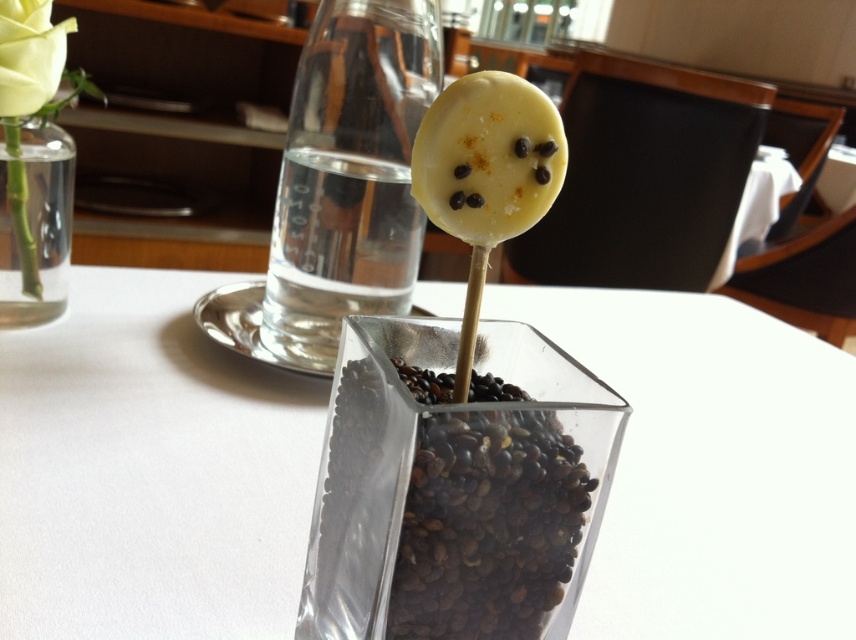
Does point (52, 307) lie behind point (45, 80)?

Yes, point (52, 307) is behind point (45, 80).

From the picture: Can you confirm if clear glass vase at left is positioned below matte yellow rose at upper left?

Indeed, clear glass vase at left is positioned under matte yellow rose at upper left.

This screenshot has height=640, width=856. Describe the element at coordinates (34, 221) in the screenshot. I see `clear glass vase at left` at that location.

Where is `clear glass vase at left`? clear glass vase at left is located at coordinates (34, 221).

Which of these two, yellow matte cookie at center or clear glass vase at left, stands taller?

clear glass vase at left is taller.

Which is more to the right, yellow matte cookie at center or clear glass vase at left?

yellow matte cookie at center is more to the right.

In order to click on yellow matte cookie at center in this screenshot , I will do pyautogui.click(x=488, y=157).

Which of these two, transparent glass vase at center or yellow matte cookie at center, stands shorter?

Standing shorter between the two is yellow matte cookie at center.

Can you confirm if transparent glass vase at center is thinner than yellow matte cookie at center?

In fact, transparent glass vase at center might be wider than yellow matte cookie at center.

Who is more distant from viewer, (670,608) or (485,152)?

Point (670,608)

Identify the location of transparent glass vase at center. The image size is (856, 640). (149, 472).